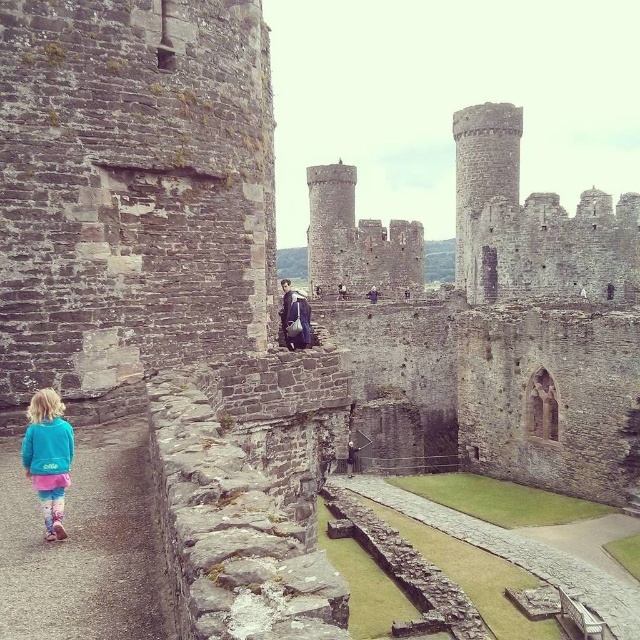
You are standing in the courtyard of Conwy Castle and want to take a photo of the brown stone castle at center. The camera you have can only focus on objects within a 0.3 unit radius from the center point of the image. Is the point marked at coordinates (522, 326) within the focus range of your camera?

The point marked at coordinates (522, 326) marks the brown stone castle at center. The camera can focus within a 0.3 unit radius from the center point of the image. Since the point is exactly at the center, it will be within the focus range.

You are a tour guide explaining the features of Conwy Castle to visitors. You point out the brown stone castle at center and the purple fabric at center. Which object is wider?

The brown stone castle at center is wider than the purple fabric at center.

You are standing in the courtyard of Conwy Castle and want to take a photo of the turquoise fleece jacket at lower left. Where should you position yourself to capture it in the frame?

To capture the turquoise fleece jacket at lower left in your photo, position yourself so that the jacket is located at the coordinates approximately 0.714 along the horizontal axis and 0.077 along the vertical axis of the frame.